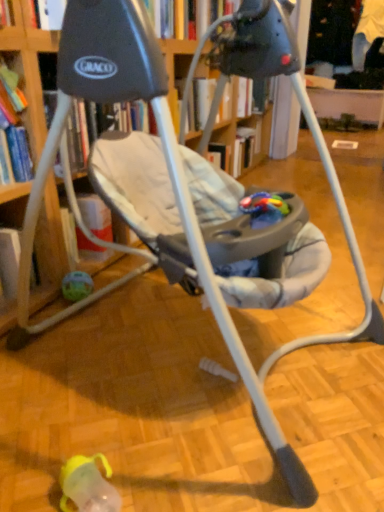
Identify the location of free space in front of translucent plastic ball at lower left, placed as the 2th toy when sorted from right to left. This screenshot has height=512, width=384. (75, 324).